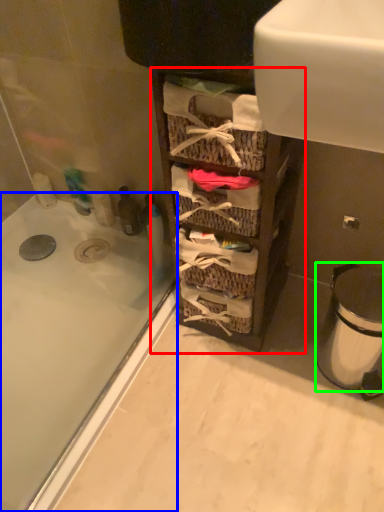
Question: Considering the real-world distances, which object is farthest from cabinetry (highlighted by a red box)? bathtub (highlighted by a blue box) or trash bin/can (highlighted by a green box)?

Choices:
 (A) bathtub
 (B) trash bin/can

Answer: (A)